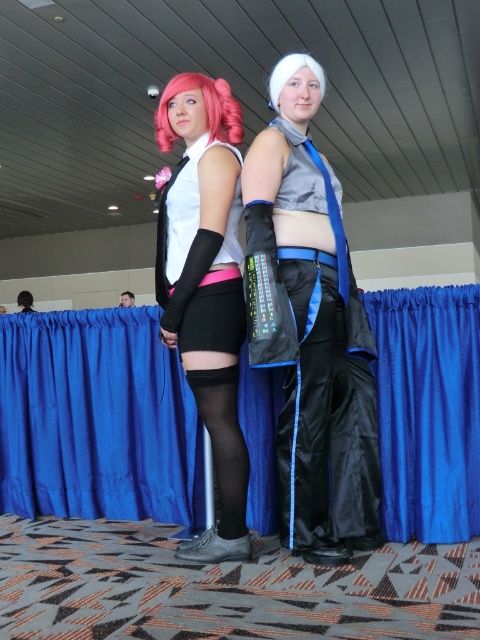
Question: Which point is farther to the camera?

Choices:
 (A) (294, 477)
 (B) (158, 147)
 (C) (265, 349)
 (D) (206, 212)

Answer: (B)

Question: Does blue fabric curtain at center appear on the right side of black satin pants at center?

Choices:
 (A) yes
 (B) no

Answer: (B)

Question: Which of the following is the closest to the observer?

Choices:
 (A) black satin pants at center
 (B) blue fabric curtain at center

Answer: (A)

Question: Among these points, which one is farthest from the camera?

Choices:
 (A) (231, 109)
 (B) (170, 211)
 (C) (117, 449)
 (D) (338, 230)

Answer: (C)

Question: Does black satin pants at center have a lesser width compared to matte black arm guard at center?

Choices:
 (A) yes
 (B) no

Answer: (B)

Question: Does shiny silver armor at center have a greater width compared to matte black skirt at center?

Choices:
 (A) no
 (B) yes

Answer: (B)